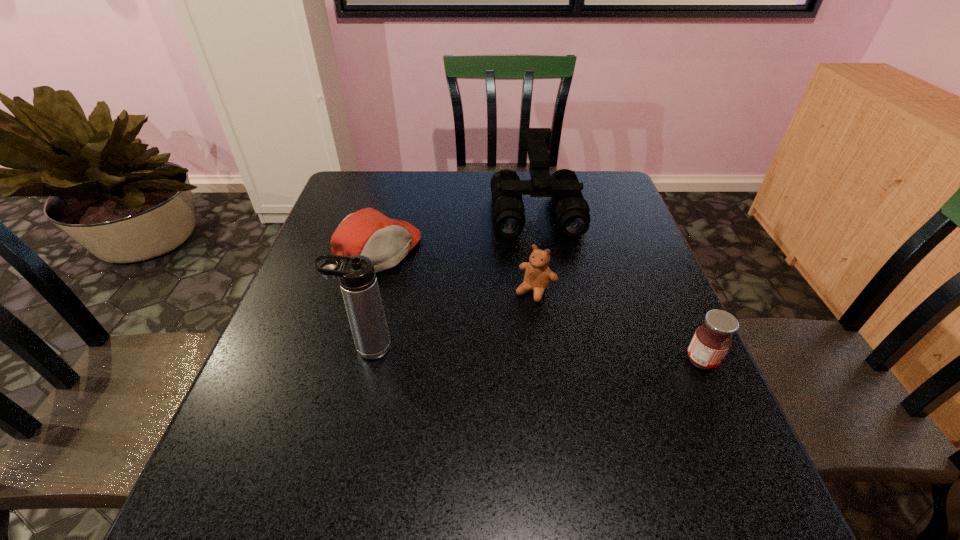
Find the location of `free space located on the front-facing side of the cap`. free space located on the front-facing side of the cap is located at coordinates click(x=447, y=290).

The width and height of the screenshot is (960, 540). What are the coordinates of `vacant area located on the front lenses of the second tallest object` in the screenshot? It's located at (552, 299).

Find the location of a particular element. This screenshot has width=960, height=540. vacant area situated 0.220m on the front lenses of the second tallest object is located at coordinates (551, 296).

You are a GUI agent. You are given a task and a screenshot of the screen. Output one action in this format:
    pyautogui.click(x=<x>, y=<y>)
    Task: Click on the vacant region located on the front lenses of the second tallest object
    
    Given the screenshot: What is the action you would take?
    pyautogui.click(x=549, y=282)

Locate an element on the screen. The height and width of the screenshot is (540, 960). vacant space located on the face of the teddy bear is located at coordinates (470, 382).

Where is `vacant space located on the face of the teddy bear`? The image size is (960, 540). vacant space located on the face of the teddy bear is located at coordinates (485, 361).

At what (x,y) coordinates should I click in order to perform the action: click on vacant area situated 0.170m on the face of the teddy bear. Please return your answer as a coordinate pair (x, y). The width and height of the screenshot is (960, 540). Looking at the image, I should click on (492, 352).

The image size is (960, 540). I want to click on object situated at the far edge, so click(x=571, y=209).

You are a GUI agent. You are given a task and a screenshot of the screen. Output one action in this format:
    pyautogui.click(x=<x>, y=<y>)
    Task: Click on the thermos bottle at the left edge
    
    Given the screenshot: What is the action you would take?
    pyautogui.click(x=357, y=278)

Identify the location of cap positioned at the left edge. (367, 232).